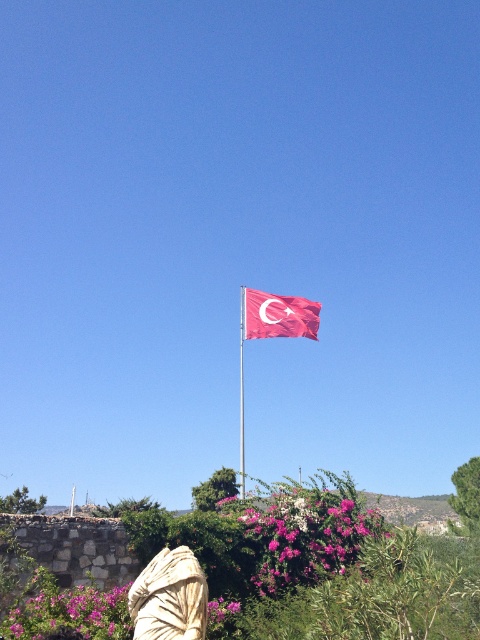
Question: Can you confirm if pink matte flowers at lower center is smaller than beige fabric robe at lower center?

Choices:
 (A) yes
 (B) no

Answer: (A)

Question: Does pink matte flower at lower left have a greater width compared to metallic flag pole at center?

Choices:
 (A) yes
 (B) no

Answer: (A)

Question: Considering the relative positions of pink matte flower at lower left and metallic flag pole at center in the image provided, where is pink matte flower at lower left located with respect to metallic flag pole at center?

Choices:
 (A) left
 (B) right

Answer: (A)

Question: Which object appears closest to the camera in this image?

Choices:
 (A) pink matte flower at lower left
 (B) red fabric flag at center
 (C) pink matte flowers at lower center
 (D) beige fabric robe at lower center

Answer: (D)

Question: Which is nearer to the pink matte flowers at lower center?

Choices:
 (A) metallic flag pole at center
 (B) beige fabric robe at lower center
 (C) pink matte flower at lower left
 (D) red fabric flag at center

Answer: (C)

Question: Which point is farther to the camera?

Choices:
 (A) beige fabric robe at lower center
 (B) pink matte flowers at lower center
 (C) metallic flag pole at center
 (D) red fabric flag at center

Answer: (D)